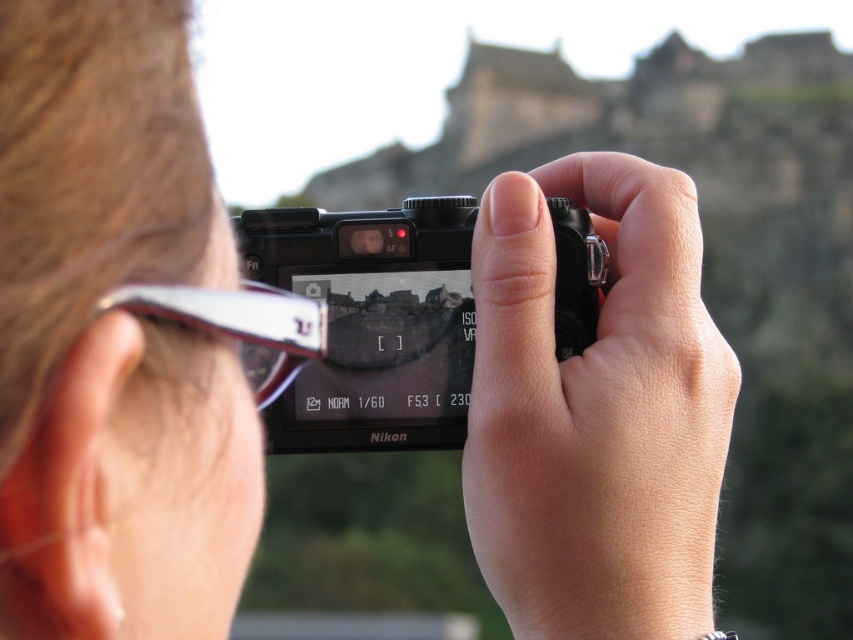
Can you confirm if smooth skin hand at center is thinner than clear plastic goggles at upper left?

Incorrect, smooth skin hand at center's width is not less than clear plastic goggles at upper left's.

Consider the image. Between smooth skin hand at center and clear plastic goggles at upper left, which one is positioned higher?

clear plastic goggles at upper left is above.

Where is `smooth skin hand at center`? The width and height of the screenshot is (853, 640). smooth skin hand at center is located at coordinates (596, 412).

You are a GUI agent. You are given a task and a screenshot of the screen. Output one action in this format:
    pyautogui.click(x=<x>, y=<y>)
    Task: Click on the smooth skin hand at center
    Image resolution: width=853 pixels, height=640 pixels.
    Given the screenshot: What is the action you would take?
    pyautogui.click(x=596, y=412)

Can you confirm if black plastic camera at center is shorter than clear plastic goggles at upper left?

No, black plastic camera at center is not shorter than clear plastic goggles at upper left.

Does black plastic camera at center have a larger size compared to clear plastic goggles at upper left?

Yes, black plastic camera at center is bigger than clear plastic goggles at upper left.

What do you see at coordinates (373, 323) in the screenshot?
I see `black plastic camera at center` at bounding box center [373, 323].

Locate an element on the screen. black plastic camera at center is located at coordinates (373, 323).

Who is positioned more to the right, smooth skin hand at center or black plastic camera at center?

smooth skin hand at center is more to the right.

Which of these two, smooth skin hand at center or black plastic camera at center, stands taller?

smooth skin hand at center is taller.

Which is behind, point (714, 451) or point (368, 301)?

Positioned behind is point (368, 301).

At what (x,y) coordinates should I click in order to perform the action: click on smooth skin hand at center. Please return your answer as a coordinate pair (x, y). Looking at the image, I should click on (596, 412).